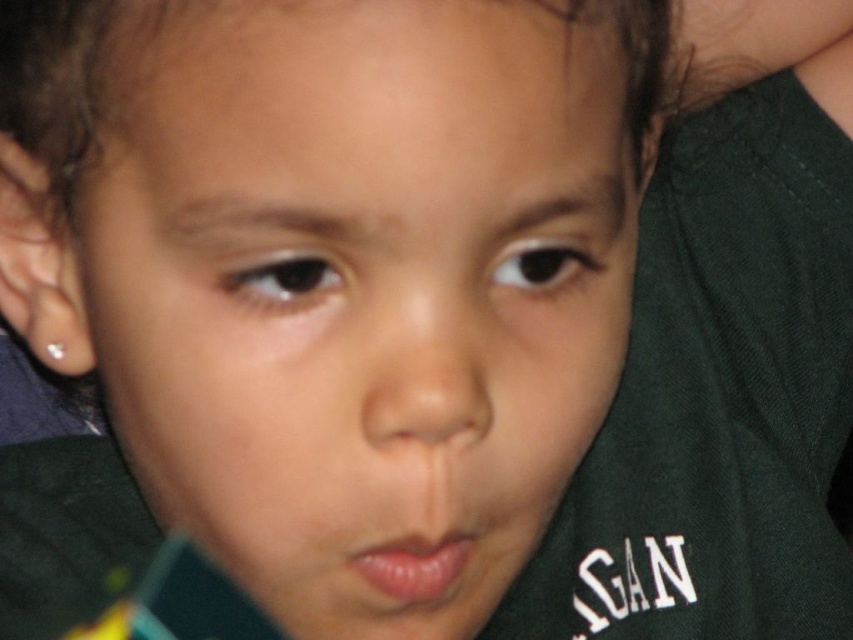
Question: Which point is farther to the camera?

Choices:
 (A) pink smooth lips at center
 (B) smooth skin face at center
 (C) smooth skin nose at center

Answer: (A)

Question: In this image, where is smooth skin nose at center located relative to pink smooth lips at center?

Choices:
 (A) below
 (B) above

Answer: (B)

Question: Is smooth skin face at center wider than smooth skin nose at center?

Choices:
 (A) yes
 (B) no

Answer: (A)

Question: Does smooth skin face at center appear on the right side of pink smooth lips at center?

Choices:
 (A) no
 (B) yes

Answer: (A)

Question: Which point is farther to the camera?

Choices:
 (A) (238, 400)
 (B) (469, 424)

Answer: (B)

Question: Which of these objects is positioned closest to the smooth skin face at center?

Choices:
 (A) pink smooth lips at center
 (B) smooth skin nose at center

Answer: (B)